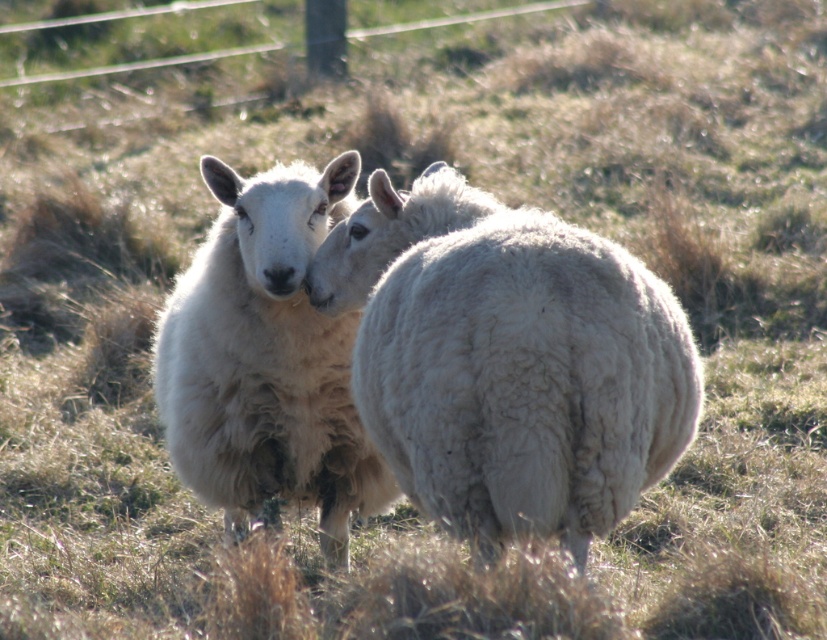
Question: Does white woolly sheep at center have a smaller size compared to white woolen sheep at center?

Choices:
 (A) yes
 (B) no

Answer: (A)

Question: Observing the image, what is the correct spatial positioning of white woolly sheep at center in reference to white woolen sheep at center?

Choices:
 (A) above
 (B) below

Answer: (A)

Question: Which point is closer to the camera taking this photo?

Choices:
 (A) (299, 461)
 (B) (457, 349)

Answer: (B)

Question: Which object is closer to the camera taking this photo?

Choices:
 (A) white woolly sheep at center
 (B) white woolen sheep at center

Answer: (A)

Question: Does white woolly sheep at center have a lesser width compared to white woolen sheep at center?

Choices:
 (A) yes
 (B) no

Answer: (B)